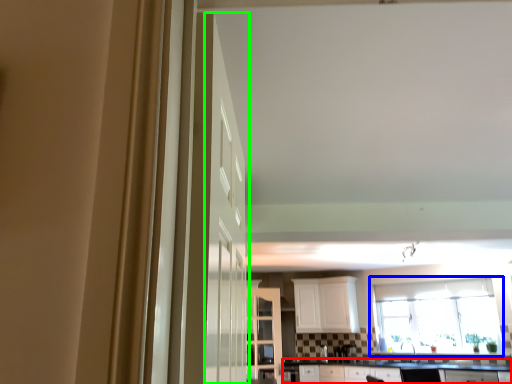
Question: Based on their relative distances, which object is nearer to countertop (highlighted by a red box)? Choose from window (highlighted by a blue box) and door (highlighted by a green box).

Choices:
 (A) window
 (B) door

Answer: (A)